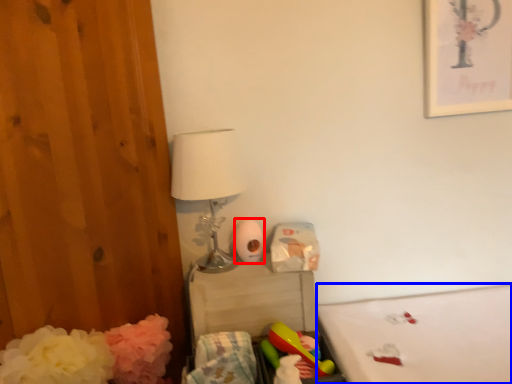
Question: Which of the following is the farthest to the observer, toilet paper (highlighted by a red box) or mattress (highlighted by a blue box)?

Choices:
 (A) toilet paper
 (B) mattress

Answer: (A)